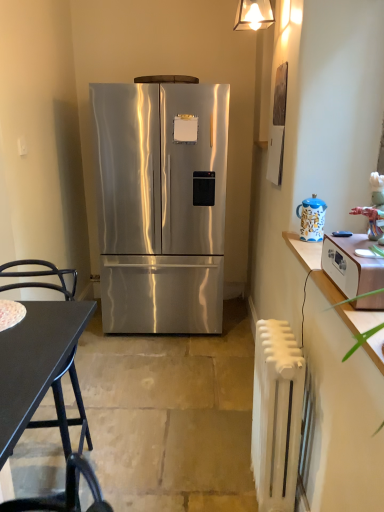
Question: In the image, is white wood cabinet at right positioned in front of or behind stainless steel refrigerator at center?

Choices:
 (A) front
 (B) behind

Answer: (A)

Question: Looking at their shapes, would you say white wood cabinet at right is wider or thinner than stainless steel refrigerator at center?

Choices:
 (A) thin
 (B) wide

Answer: (A)

Question: Which object is the farthest from the stainless steel refrigerator at center?

Choices:
 (A) black matte desk at lower left
 (B) matte glass lampshade at upper center
 (C) blue ceramic teapot at right
 (D) white painted metal radiator at right
 (E) white wood cabinet at right

Answer: (A)

Question: Estimate the real-world distances between objects in this image. Which object is farther from the wooden toaster at right?

Choices:
 (A) stainless steel refrigerator at center
 (B) white wood cabinet at right
 (C) white painted metal radiator at right
 (D) matte glass lampshade at upper center
 (E) blue ceramic teapot at right

Answer: (D)